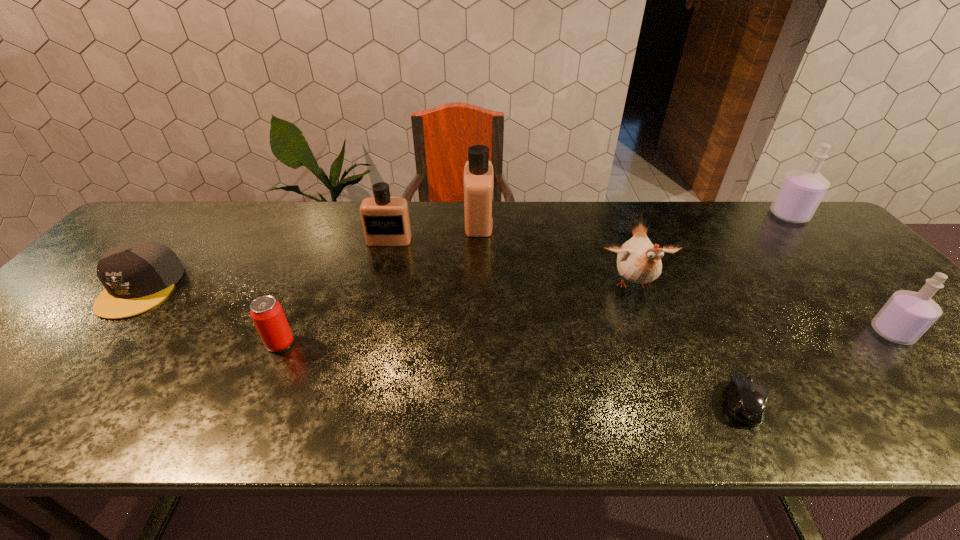
Find the location of a particular element. empty space that is in between the nearest object and the nearest perfume is located at coordinates (818, 368).

Locate an element on the screen. This screenshot has width=960, height=540. free spot between the bigger beige perfume and the bigger purple perfume is located at coordinates (634, 218).

Identify the location of free space between the nearest perfume and the bigger beige perfume. 685,277.

The height and width of the screenshot is (540, 960). I want to click on free area in between the leftmost perfume and the farther purple perfume, so click(589, 228).

This screenshot has width=960, height=540. Identify the location of unoccupied area between the white bird and the red beer can. (457, 315).

Locate an element on the screen. free space between the smaller beige perfume and the bird is located at coordinates (512, 263).

The height and width of the screenshot is (540, 960). I want to click on free area in between the smaller purple perfume and the bigger beige perfume, so [685, 277].

Identify the location of free space between the third shortest object and the third perfume from right to left. (379, 282).

Image resolution: width=960 pixels, height=540 pixels. I want to click on empty space that is in between the nearer purple perfume and the gray cap, so click(516, 310).

You are a GUI agent. You are given a task and a screenshot of the screen. Output one action in this format:
    pyautogui.click(x=<x>, y=<y>)
    Task: Click on the vacant area that lies between the red beer can and the farther purple perfume
    This screenshot has height=540, width=960.
    Given the screenshot: What is the action you would take?
    pyautogui.click(x=535, y=279)